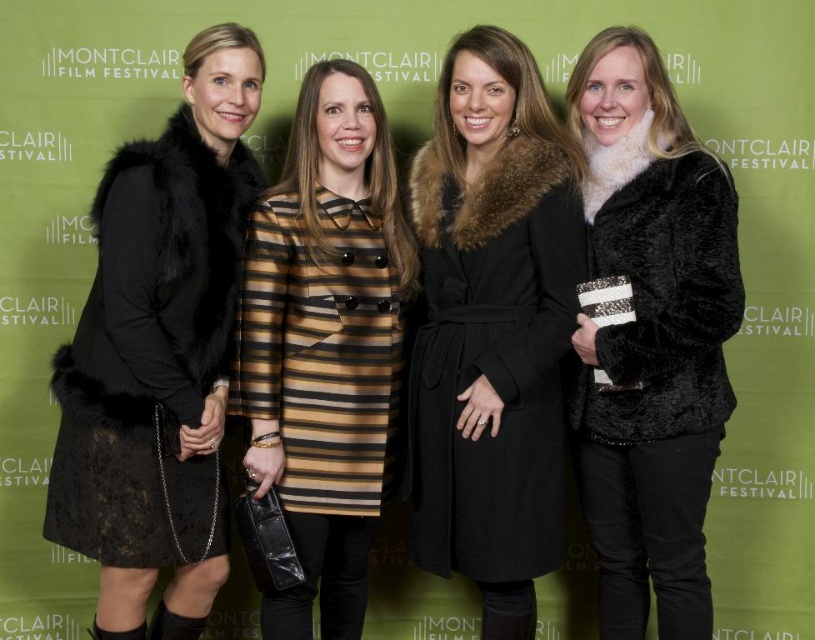
You are a photographer at the Montclair Film Festival. You need to position two coats, the black wool coat at center and the fuzzy black coat at right, so that they are exactly 30 centimeters apart. Based on their current positions, should you move them closer together or farther apart?

The black wool coat at center and fuzzy black coat at right are currently 27.97 centimeters apart. To reach the desired 30 centimeters, you need to move them farther apart by approximately 2.03 centimeters.

You are a photographer trying to frame a shot that includes both the striped fabric dress at center and the black suede boot at lower left. Which object should you adjust your camera angle to focus on first if you want to ensure both are fully visible in the frame?

The striped fabric dress at center might be wider than the black suede boot at lower left, so you should focus on the striped fabric dress at center first to ensure it fits within the frame, then adjust to include the black suede boot at lower left.